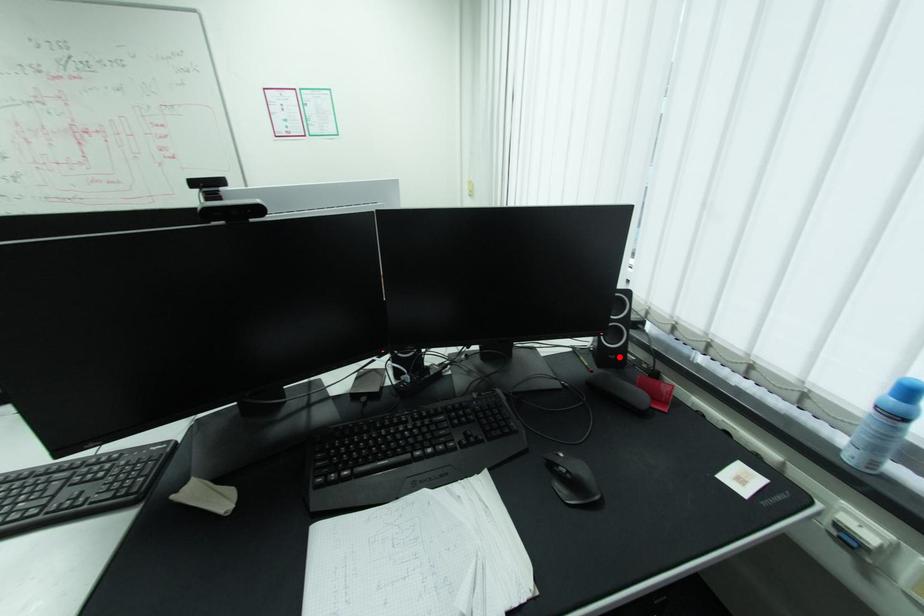
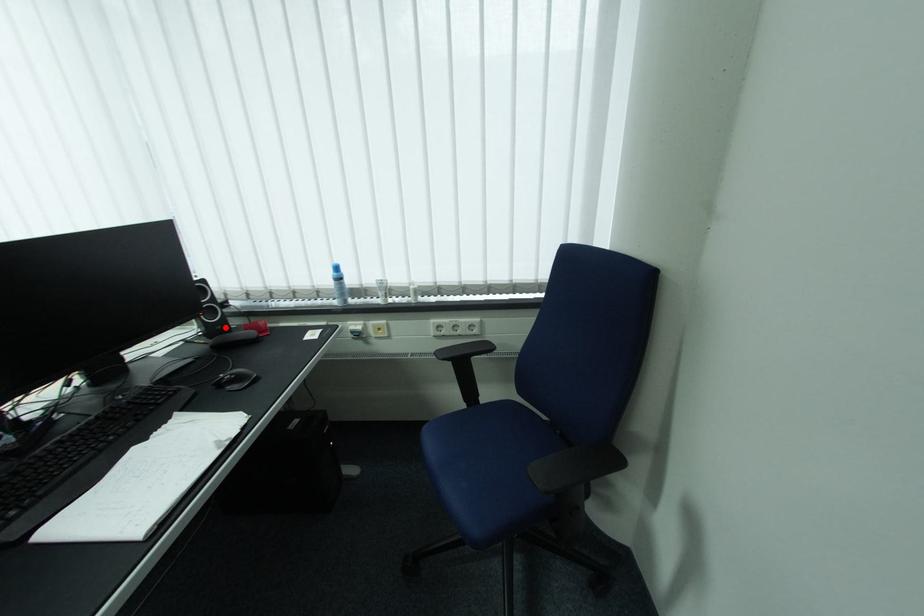
I am providing you with two images of the same scene from different viewpoints. A red point is marked on the first image and another point is marked on the second image. Is the marked point in image1 the same physical position as the marked point in image2?

Yes